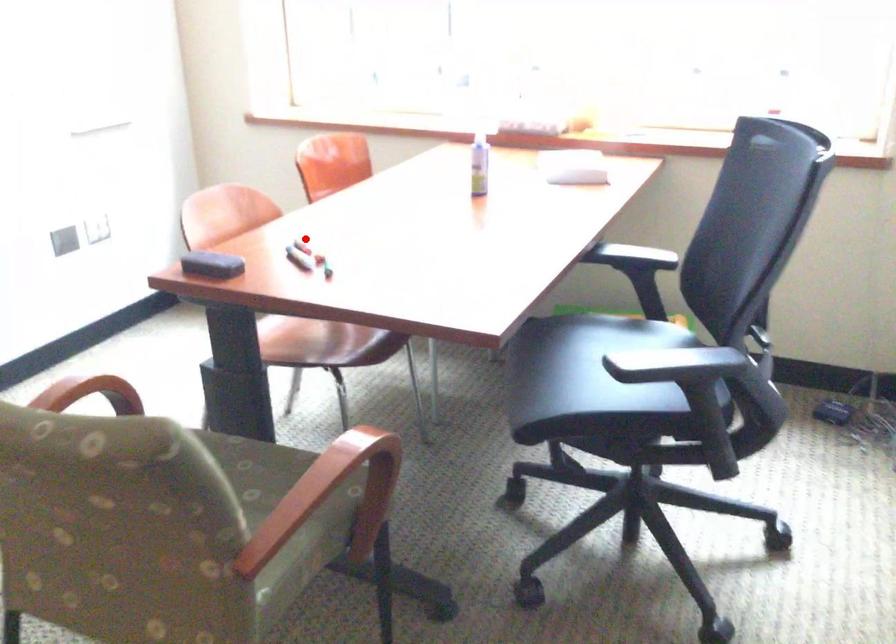
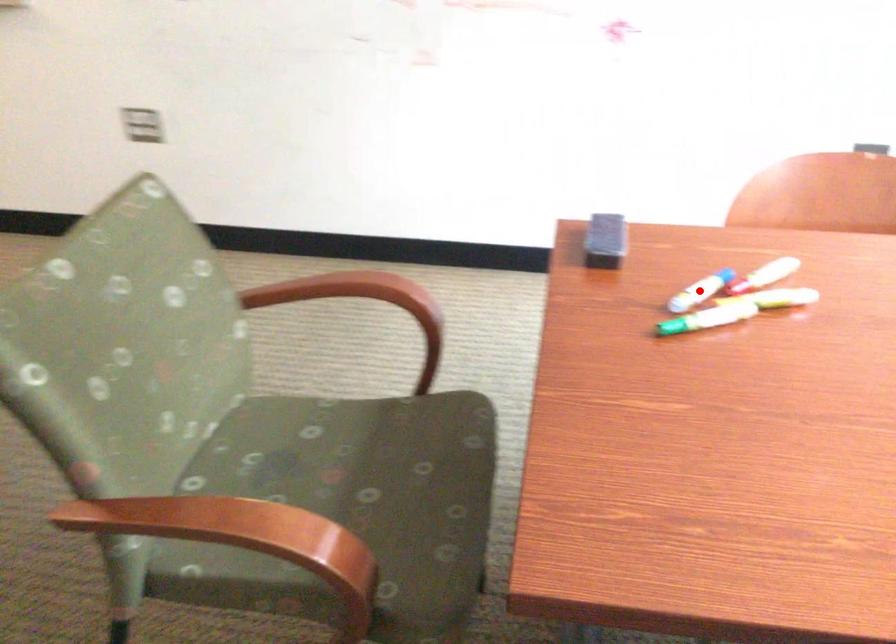
I am providing you with two images of the same scene from different viewpoints. A red point is marked on the first image and another point is marked on the second image. Is the marked point in image1 the same physical position as the marked point in image2?

No